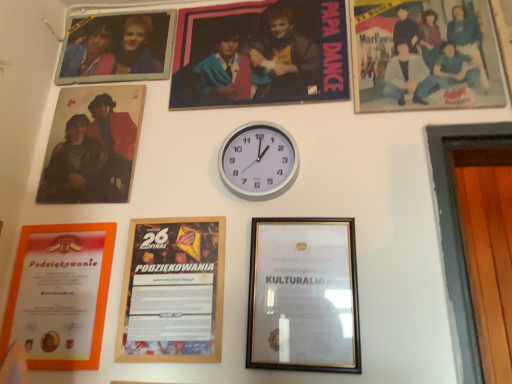
Describe the element at coordinates (92, 145) in the screenshot. I see `matte wooden photo frame at upper left, the 2th picture frame in the left-to-right sequence` at that location.

Image resolution: width=512 pixels, height=384 pixels. I want to click on wooden framed certificate at center, which is counted as the fourth picture frame, starting from the left, so click(x=172, y=291).

The image size is (512, 384). What do you see at coordinates (303, 295) in the screenshot?
I see `gold metallic picture frame at center, the sixth picture frame positioned from the left` at bounding box center [303, 295].

What is the approximate height of orange paper certificate at lower left, arranged as the 7th picture frame when viewed from the right?

orange paper certificate at lower left, arranged as the 7th picture frame when viewed from the right, is 13.72 inches in height.

I want to click on matte plastic poster at upper center, the third picture frame from the right, so click(x=260, y=54).

From the image's perspective, starting from the gold metallic picture frame at center, the second picture frame when ordered from right to left, which picture frame is the 3rd one above? Please provide its 2D coordinates.

[(260, 54)]

From a real-world perspective, is gold metallic picture frame at center, the sixth picture frame positioned from the left, above or below matte plastic poster at upper center, the third picture frame from the right?

In terms of real-world spatial position, gold metallic picture frame at center, the sixth picture frame positioned from the left, is below matte plastic poster at upper center, the third picture frame from the right.

Consider the image. From the image's perspective, is gold metallic picture frame at center, the sixth picture frame positioned from the left, beneath matte plastic poster at upper center, the third picture frame from the right?

Yes, from the image's perspective, gold metallic picture frame at center, the sixth picture frame positioned from the left, is below matte plastic poster at upper center, the third picture frame from the right.

Is gold metallic picture frame at center, the sixth picture frame positioned from the left, looking in the opposite direction of matte plastic poster at upper center, the third picture frame from the right?

gold metallic picture frame at center, the sixth picture frame positioned from the left, is not turned away from matte plastic poster at upper center, the third picture frame from the right.

Considering the positions of points (292, 221) and (110, 224), is point (292, 221) closer to camera compared to point (110, 224)?

Yes, point (292, 221) is closer to viewer.

Would you say gold metallic picture frame at center, the second picture frame when ordered from right to left, is inside or outside orange paper certificate at lower left, which appears as the first picture frame when viewed from the left?

gold metallic picture frame at center, the second picture frame when ordered from right to left, is not enclosed by orange paper certificate at lower left, which appears as the first picture frame when viewed from the left.

Considering the sizes of gold metallic picture frame at center, the sixth picture frame positioned from the left, and orange paper certificate at lower left, which appears as the first picture frame when viewed from the left, in the image, is gold metallic picture frame at center, the sixth picture frame positioned from the left, taller or shorter than orange paper certificate at lower left, which appears as the first picture frame when viewed from the left,?

Clearly, gold metallic picture frame at center, the sixth picture frame positioned from the left, is shorter compared to orange paper certificate at lower left, which appears as the first picture frame when viewed from the left.

Does gold metallic picture frame at center, the second picture frame when ordered from right to left, appear on the left side of orange paper certificate at lower left, which appears as the first picture frame when viewed from the left?

No, gold metallic picture frame at center, the second picture frame when ordered from right to left, is not to the left of orange paper certificate at lower left, which appears as the first picture frame when viewed from the left.

In terms of height, does matte wooden photo frame at upper left, the 2th picture frame in the left-to-right sequence, look taller or shorter compared to wooden framed certificate at center, which is counted as the fourth picture frame, starting from the left?

In the image, matte wooden photo frame at upper left, the 2th picture frame in the left-to-right sequence, appears to be shorter than wooden framed certificate at center, which is counted as the fourth picture frame, starting from the left.

How distant is matte wooden photo frame at upper left, which is counted as the 6th picture frame, starting from the right, from wooden framed certificate at center, the fourth picture frame from the right?

They are 10.97 inches apart.

Is the depth of matte wooden photo frame at upper left, which is counted as the 6th picture frame, starting from the right, greater than that of wooden framed certificate at center, the fourth picture frame from the right?

Yes, it is behind wooden framed certificate at center, the fourth picture frame from the right.

Is matte wooden photo frame at upper left, the 2th picture frame in the left-to-right sequence, completely or partially outside of wooden framed certificate at center, the fourth picture frame from the right?

Yes, matte wooden photo frame at upper left, the 2th picture frame in the left-to-right sequence, is outside of wooden framed certificate at center, the fourth picture frame from the right.

In the image, is matte plastic poster at upper center, the third picture frame from the right, positioned in front of or behind wooden framed certificate at center, the fourth picture frame from the right?

Visually, matte plastic poster at upper center, the third picture frame from the right, is located behind wooden framed certificate at center, the fourth picture frame from the right.

How many degrees apart are the facing directions of matte plastic poster at upper center, the third picture frame from the right, and wooden framed certificate at center, the fourth picture frame from the right?

The facing directions of matte plastic poster at upper center, the third picture frame from the right, and wooden framed certificate at center, the fourth picture frame from the right, are 0.00275 degrees apart.

Considering the sizes of matte plastic poster at upper center, the third picture frame from the right, and wooden framed certificate at center, the fourth picture frame from the right, in the image, is matte plastic poster at upper center, the third picture frame from the right, wider or thinner than wooden framed certificate at center, the fourth picture frame from the right,?

In the image, matte plastic poster at upper center, the third picture frame from the right, appears to be wider than wooden framed certificate at center, the fourth picture frame from the right.

Does matte plastic poster at upper center, positioned as the fifth picture frame in left-to-right order, appear on the right side of wooden framed certificate at center, the fourth picture frame from the right?

Yes.

Measure the distance from matte plastic poster at upper center, the third picture frame from the right, to matte wooden photo frame at upper left, the 2th picture frame in the left-to-right sequence.

matte plastic poster at upper center, the third picture frame from the right, is 11.85 inches away from matte wooden photo frame at upper left, the 2th picture frame in the left-to-right sequence.

Which is more to the left, matte plastic poster at upper center, positioned as the fifth picture frame in left-to-right order, or matte wooden photo frame at upper left, which is counted as the 6th picture frame, starting from the right?

From the viewer's perspective, matte wooden photo frame at upper left, which is counted as the 6th picture frame, starting from the right, appears more on the left side.

Find the location of a particular element. This screenshot has height=384, width=512. picture frame that is the 1st one when counting backward from the matte wooden photo frame at upper left, which is counted as the 6th picture frame, starting from the right is located at coordinates (260, 54).

Which is less distant, (231, 80) or (87, 157)?

Point (231, 80) appears to be farther away from the viewer than point (87, 157).

Which is correct: white metallic clock at center is inside matte plastic poster at upper center, the third picture frame from the right, or outside of it?

The correct answer is: outside.

From the image's perspective, is white metallic clock at center on matte plastic poster at upper center, the third picture frame from the right?

No, from the image's perspective, white metallic clock at center is not above matte plastic poster at upper center, the third picture frame from the right.

Is white metallic clock at center turned away from matte plastic poster at upper center, positioned as the fifth picture frame in left-to-right order?

white metallic clock at center does not have its back to matte plastic poster at upper center, positioned as the fifth picture frame in left-to-right order.

Looking at this image, can you confirm if white metallic clock at center is taller than matte plastic poster at upper center, positioned as the fifth picture frame in left-to-right order?

Incorrect, the height of white metallic clock at center is not larger of that of matte plastic poster at upper center, positioned as the fifth picture frame in left-to-right order.

Considering the relative sizes of matte plastic photo at upper right, the 7th picture frame from the left, and wooden framed certificate at center, which is counted as the fourth picture frame, starting from the left, in the image provided, is matte plastic photo at upper right, the 7th picture frame from the left, taller than wooden framed certificate at center, which is counted as the fourth picture frame, starting from the left,?

Indeed, matte plastic photo at upper right, the 7th picture frame from the left, has a greater height compared to wooden framed certificate at center, which is counted as the fourth picture frame, starting from the left.

Could wooden framed certificate at center, which is counted as the fourth picture frame, starting from the left, be considered to be inside matte plastic photo at upper right, the 7th picture frame from the left?

Definitely not — wooden framed certificate at center, which is counted as the fourth picture frame, starting from the left, is not inside matte plastic photo at upper right, the 7th picture frame from the left.

From a real-world perspective, between matte plastic photo at upper right, arranged as the 1th picture frame when viewed from the right, and wooden framed certificate at center, the fourth picture frame from the right, who is vertically lower?

wooden framed certificate at center, the fourth picture frame from the right, is physically lower.

The height and width of the screenshot is (384, 512). I want to click on the 3rd picture frame below the matte plastic poster at upper center, the third picture frame from the right (from a real-world perspective), so click(x=303, y=295).

Identify the location of the 5th picture frame to the left of the gold metallic picture frame at center, the sixth picture frame positioned from the left, starting your count from the anchor. (60, 295).

Considering their positions, is orange paper certificate at lower left, arranged as the 7th picture frame when viewed from the right, positioned closer to gold metallic picture frame at center, the sixth picture frame positioned from the left, than matte plastic poster at upper center, the third picture frame from the right?

orange paper certificate at lower left, arranged as the 7th picture frame when viewed from the right, lies closer to gold metallic picture frame at center, the sixth picture frame positioned from the left, than the other object.

Looking at the image, which one is located closer to wooden framed certificate at center, which is counted as the fourth picture frame, starting from the left, matte plastic photo at upper right, the 7th picture frame from the left, or gold metallic picture frame at center, the second picture frame when ordered from right to left?

The object closer to wooden framed certificate at center, which is counted as the fourth picture frame, starting from the left, is gold metallic picture frame at center, the second picture frame when ordered from right to left.

Based on their spatial positions, is matte wooden photo frame at upper left, which is counted as the 6th picture frame, starting from the right, or matte plastic photo at upper right, arranged as the 1th picture frame when viewed from the right, closer to white metallic clock at center?

Based on the image, matte wooden photo frame at upper left, which is counted as the 6th picture frame, starting from the right, appears to be nearer to white metallic clock at center.

Estimate the real-world distances between objects in this image. Which object is further from orange paper certificate at lower left, arranged as the 7th picture frame when viewed from the right, gold metallic picture frame at center, the sixth picture frame positioned from the left, or white metallic clock at center?

Among the two, gold metallic picture frame at center, the sixth picture frame positioned from the left, is located further to orange paper certificate at lower left, arranged as the 7th picture frame when viewed from the right.

Which object lies further to the anchor point metallic photo frame at upper left, the fifth picture frame in the right-to-left sequence, white metallic clock at center or orange paper certificate at lower left, which appears as the first picture frame when viewed from the left?

The object further to metallic photo frame at upper left, the fifth picture frame in the right-to-left sequence, is orange paper certificate at lower left, which appears as the first picture frame when viewed from the left.

When comparing their distances from metallic photo frame at upper left, placed as the third picture frame when sorted from left to right, does gold metallic picture frame at center, the second picture frame when ordered from right to left, or matte plastic poster at upper center, positioned as the fifth picture frame in left-to-right order, seem closer?

matte plastic poster at upper center, positioned as the fifth picture frame in left-to-right order.

Which object lies further to the anchor point white metallic clock at center, gold metallic picture frame at center, the sixth picture frame positioned from the left, or matte plastic poster at upper center, positioned as the fifth picture frame in left-to-right order?

Based on the image, matte plastic poster at upper center, positioned as the fifth picture frame in left-to-right order, appears to be further to white metallic clock at center.

Estimate the real-world distances between objects in this image. Which object is closer to gold metallic picture frame at center, the second picture frame when ordered from right to left, metallic photo frame at upper left, placed as the third picture frame when sorted from left to right, or matte plastic photo at upper right, arranged as the 1th picture frame when viewed from the right?

Among the two, matte plastic photo at upper right, arranged as the 1th picture frame when viewed from the right, is located nearer to gold metallic picture frame at center, the second picture frame when ordered from right to left.

This screenshot has width=512, height=384. I want to click on wall clock between wooden framed certificate at center, the fourth picture frame from the right, and matte plastic photo at upper right, the 7th picture frame from the left, so click(x=258, y=159).

Find the location of a particular element. The width and height of the screenshot is (512, 384). wall clock between metallic photo frame at upper left, the fifth picture frame in the right-to-left sequence, and matte plastic poster at upper center, positioned as the fifth picture frame in left-to-right order, in the horizontal direction is located at coordinates (258, 159).

Identify the location of picture frame between white metallic clock at center and wooden framed certificate at center, which is counted as the fourth picture frame, starting from the left, in the vertical direction. (303, 295).

Locate an element on the screen. wall clock located between matte wooden photo frame at upper left, which is counted as the 6th picture frame, starting from the right, and gold metallic picture frame at center, the second picture frame when ordered from right to left, in the left-right direction is located at coordinates (258, 159).